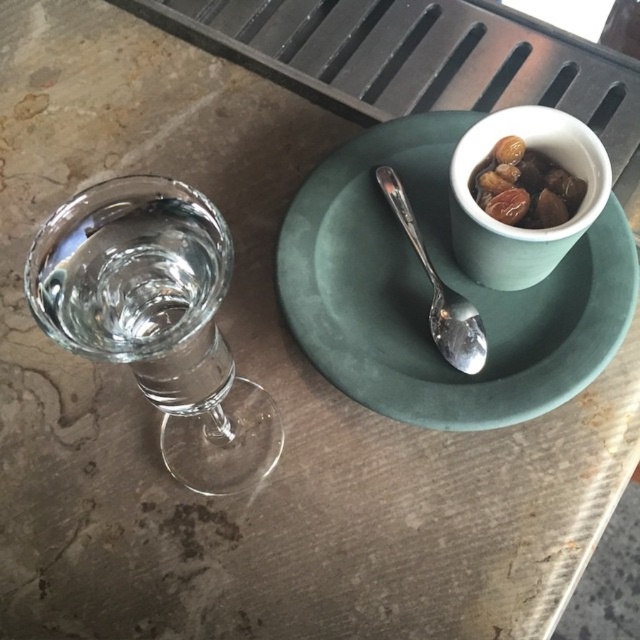
You are setting up a table for a small gathering and want to ensure that the white matte cup at upper right and the satin silver spoon at center are visible to guests seated across the table. Since the cup is shorter than the spoon, which object might guests have an easier time seeing from a distance? Please explain your reasoning based on their heights.

The satin silver spoon at center is taller than the white matte cup at upper right. Since the spoon is taller, it will likely be more visible to guests from a distance compared to the shorter cup.

You are setting up a table for a small gathering. You have a transparent glass at left and brown matte nuts at upper right. Where should you place a centerpiece so it is between both items?

The transparent glass at left is to the left of brown matte nuts at upper right, so the centerpiece should be placed between them, ensuring it is positioned to the right of the transparent glass at left and to the left of the brown matte nuts at upper right.

You are setting up a table for a small gathering. You have a green matte plate at center and brown matte nuts at upper right. According to the scene, where should you place the nuts relative to the plate?

The brown matte nuts at upper right should be placed to the right of the green matte plate at center, as the green matte plate at center is to the left of brown matte nuts at upper right in the scene.